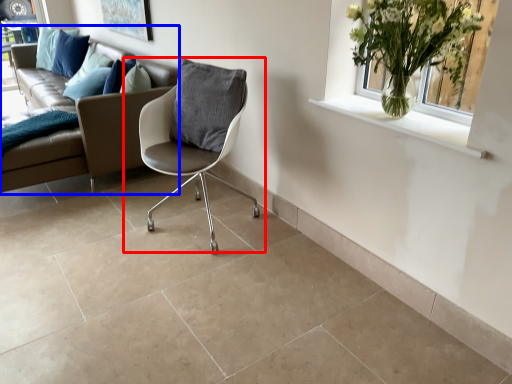
Question: Which object is further to the camera taking this photo, chair (highlighted by a red box) or studio couch (highlighted by a blue box)?

Choices:
 (A) chair
 (B) studio couch

Answer: (B)